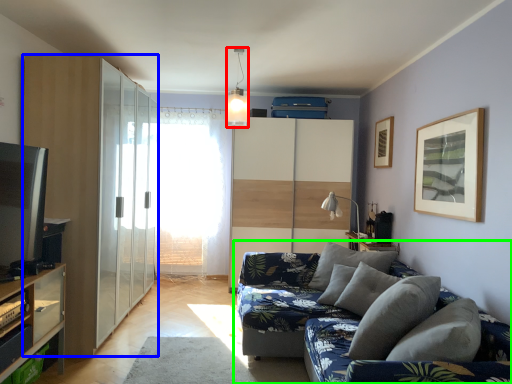
Question: Considering the real-world distances, which object is farthest from light fixture (highlighted by a red box)? dresser (highlighted by a blue box) or studio couch (highlighted by a green box)?

Choices:
 (A) dresser
 (B) studio couch

Answer: (B)